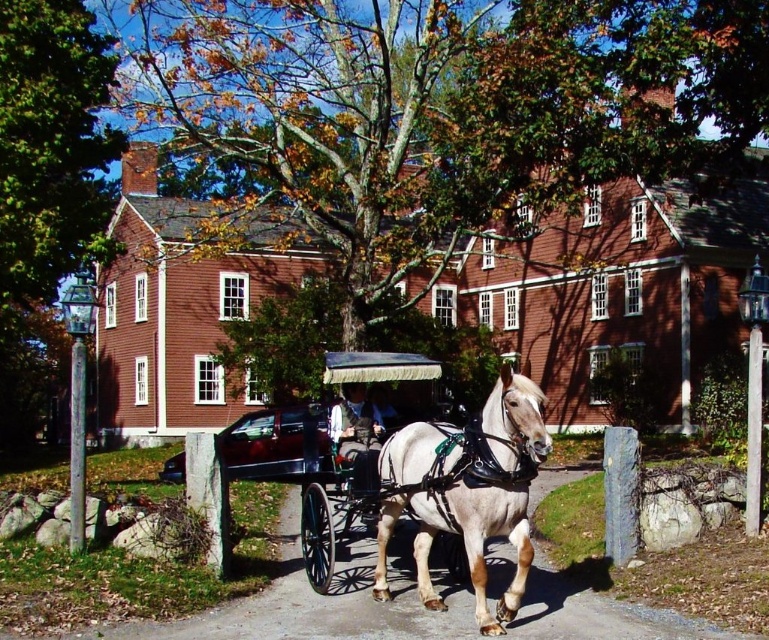
Question: Observing the image, what is the correct spatial positioning of white glossy horse at center in reference to smooth black coach at center?

Choices:
 (A) above
 (B) below

Answer: (B)

Question: Which object appears closest to the camera in this image?

Choices:
 (A) white glossy horse at center
 (B) white leather wagon at center

Answer: (A)

Question: Which point is farther to the camera?

Choices:
 (A) (345, 400)
 (B) (345, 445)
 (C) (471, 481)

Answer: (A)

Question: Is white glossy horse at center to the left of white leather wagon at center from the viewer's perspective?

Choices:
 (A) yes
 (B) no

Answer: (B)

Question: Does white glossy horse at center have a smaller size compared to smooth black coach at center?

Choices:
 (A) yes
 (B) no

Answer: (B)

Question: Which object is the closest to the white leather wagon at center?

Choices:
 (A) smooth black coach at center
 (B) white glossy horse at center

Answer: (A)